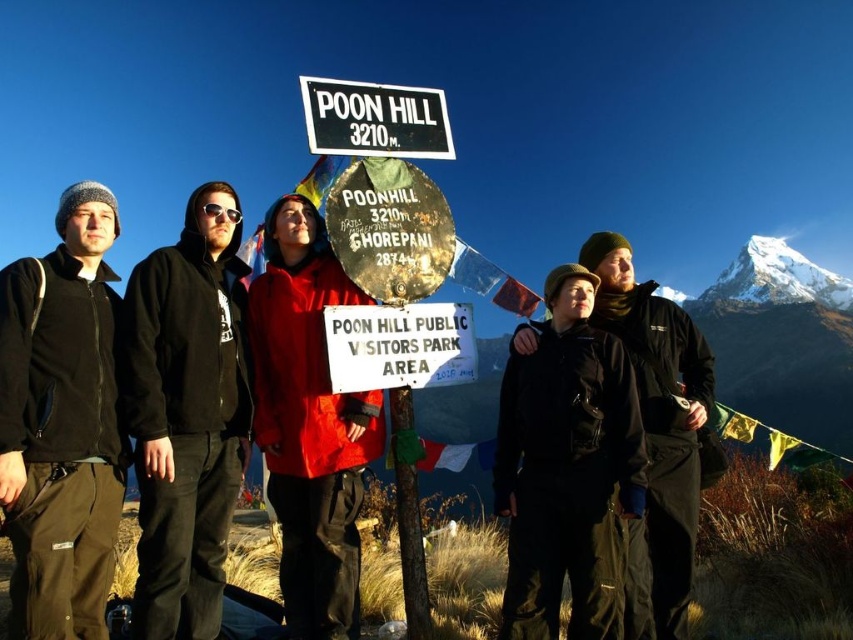
Is matte black jacket at left positioned at the back of dark green jacket at center?

No, it is not.

Does matte black jacket at left come in front of dark green jacket at center?

Yes.

Does point (109, 268) come closer to viewer compared to point (643, 524)?

No, (109, 268) is further to viewer.

This screenshot has height=640, width=853. What are the coordinates of `matte black jacket at left` in the screenshot? It's located at (61, 422).

Which is in front, point (71, 195) or point (180, 490)?

Point (180, 490)

Can you confirm if matte black jacket at left is shorter than black fleece jacket at left?

No.

Between point (10, 273) and point (164, 288), which one is positioned in front?

Point (10, 273) is more forward.

Identify the location of matte black jacket at left. The width and height of the screenshot is (853, 640). (61, 422).

Which is more to the left, black fleece jacket at left or dark green jacket at center?

black fleece jacket at left

Can you confirm if black fleece jacket at left is positioned to the left of dark green jacket at center?

Correct, you'll find black fleece jacket at left to the left of dark green jacket at center.

Based on the photo, who is more forward, (132, 420) or (682, 536)?

Positioned in front is point (132, 420).

At what (x,y) coordinates should I click in order to perform the action: click on black fleece jacket at left. Please return your answer as a coordinate pair (x, y). The width and height of the screenshot is (853, 640). Looking at the image, I should click on (187, 413).